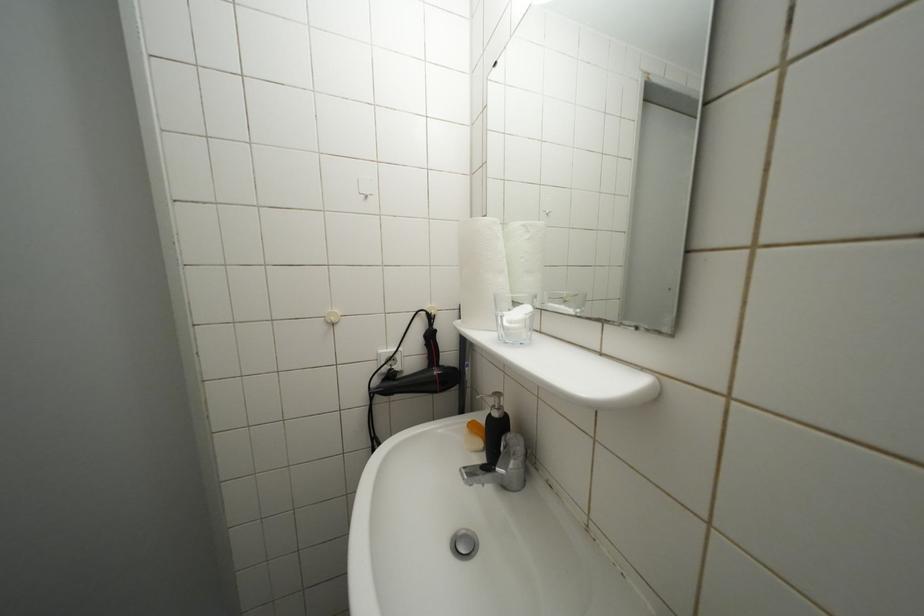
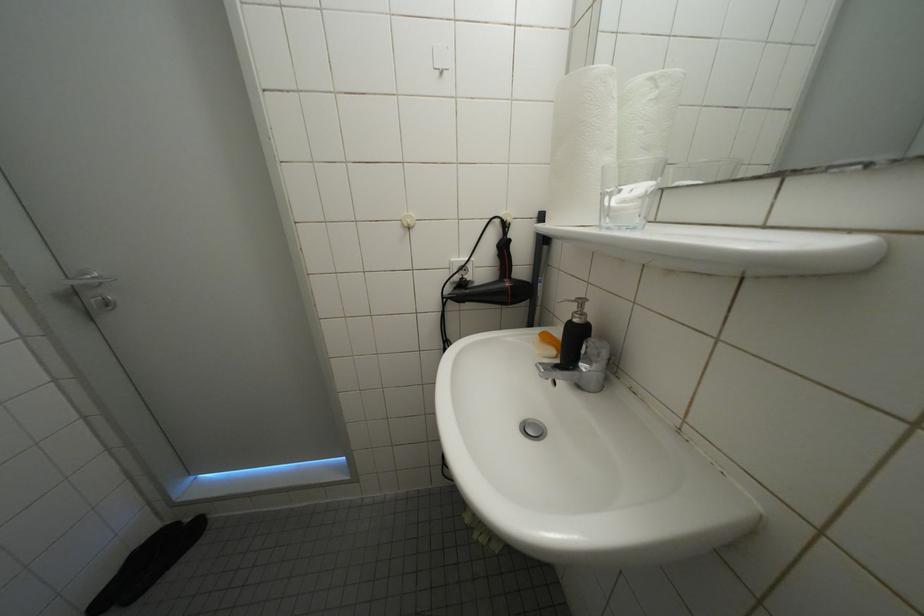
Question: Based on the continuous images, in which direction is the camera rotating? Reply with the corresponding letter.

Choices:
 (A) Left
 (B) Right
 (C) Up
 (D) Down

Answer: (D)